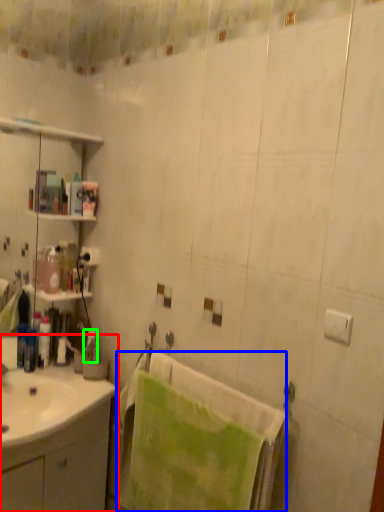
Question: Based on their relative distances, which object is farther from bathroom cabinet (highlighted by a red box)? Choose from beach towel (highlighted by a blue box) and toiletry (highlighted by a green box).

Choices:
 (A) beach towel
 (B) toiletry

Answer: (B)